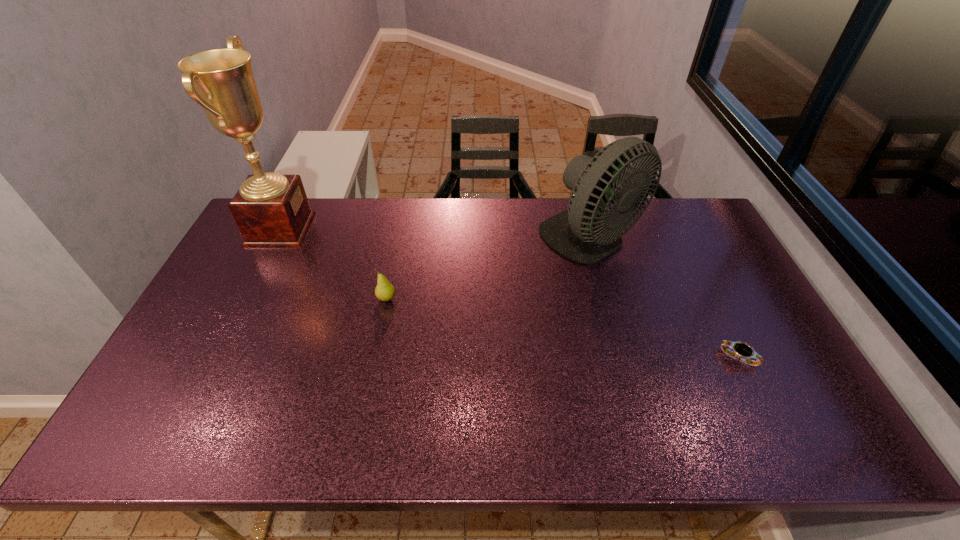
Image resolution: width=960 pixels, height=540 pixels. In order to click on free point between the second object from right to left and the nearest object in this screenshot , I will do `click(664, 300)`.

This screenshot has width=960, height=540. What are the coordinates of `object that ranks as the closest to the shortest object` in the screenshot? It's located at (577, 233).

Identify the location of object that is the second closest to the second object from right to left. The height and width of the screenshot is (540, 960). (384, 291).

Where is `free space in the image that satisfies the following two spatial constraints: 1. on the plaque of the trophy cup; 2. on the left side of the nearest object`? The image size is (960, 540). free space in the image that satisfies the following two spatial constraints: 1. on the plaque of the trophy cup; 2. on the left side of the nearest object is located at coordinates (216, 357).

The height and width of the screenshot is (540, 960). In order to click on vacant space that satisfies the following two spatial constraints: 1. on the front side of the shortest object; 2. on the right side of the second object from left to right in this screenshot , I will do `click(374, 357)`.

The image size is (960, 540). I want to click on free space that satisfies the following two spatial constraints: 1. on the plaque of the tallest object; 2. on the back side of the nearest object, so click(216, 357).

Locate an element on the screen. The image size is (960, 540). free region that satisfies the following two spatial constraints: 1. on the plaque of the leftmost object; 2. on the left side of the pear is located at coordinates (246, 299).

Identify the location of vacant area in the image that satisfies the following two spatial constraints: 1. in front of the second object from right to left to direct airflow; 2. on the right side of the watch. (622, 357).

Locate an element on the screen. Image resolution: width=960 pixels, height=540 pixels. free space that satisfies the following two spatial constraints: 1. in front of the third object from left to right to direct airflow; 2. on the left side of the watch is located at coordinates (622, 357).